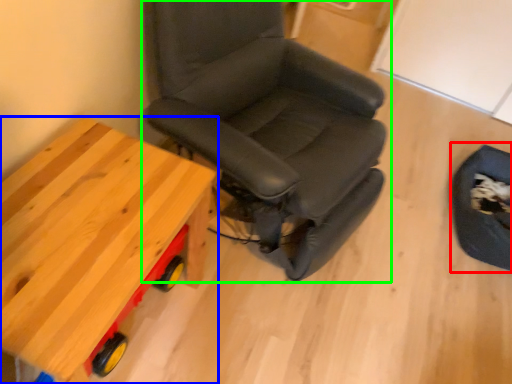
Question: Based on their relative distances, which object is farther from swivel chair (highlighted by a red box)? Choose from table (highlighted by a blue box) and chair (highlighted by a green box).

Choices:
 (A) table
 (B) chair

Answer: (A)